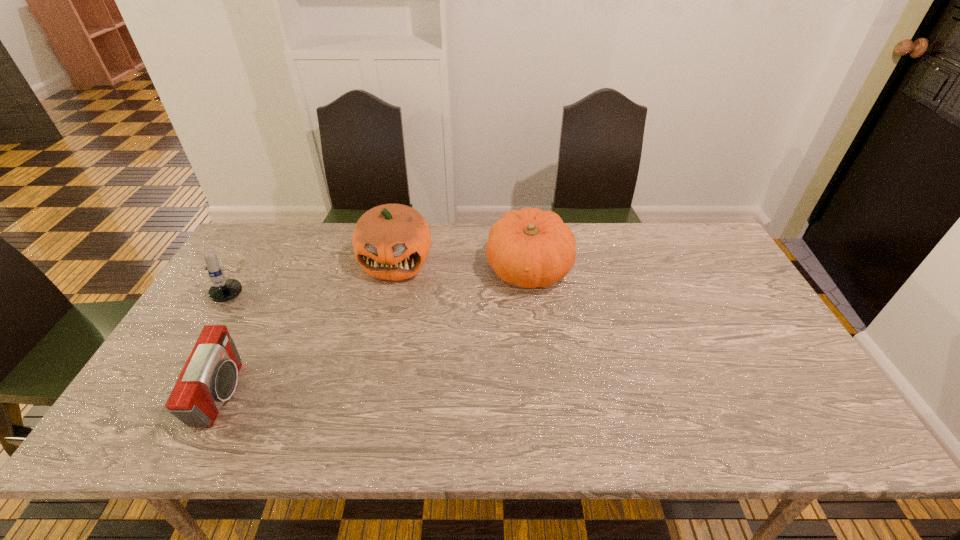
You are a GUI agent. You are given a task and a screenshot of the screen. Output one action in this format:
    pyautogui.click(x=<x>, y=<y>)
    Task: Click on the vacant area that lies between the right pumpkin and the left pumpkin
    
    Given the screenshot: What is the action you would take?
    pyautogui.click(x=462, y=265)

Where is `free spot between the second object from right to left and the rightmost object`? free spot between the second object from right to left and the rightmost object is located at coordinates (462, 265).

The image size is (960, 540). I want to click on vacant area between the third object from left to right and the leftmost object, so click(317, 272).

This screenshot has height=540, width=960. What are the coordinates of `free space between the left pumpkin and the right pumpkin` in the screenshot? It's located at (462, 265).

The image size is (960, 540). In order to click on free area in between the leftmost object and the left pumpkin in this screenshot , I will do `click(317, 272)`.

Where is `vacant space that is in between the second object from right to left and the microphone`? vacant space that is in between the second object from right to left and the microphone is located at coordinates (317, 272).

Identify which object is located as the nearest to the microphone. Please provide its 2D coordinates. Your answer should be formatted as a tuple, i.e. [(x, y)], where the tuple contains the x and y coordinates of a point satisfying the conditions above.

[(209, 378)]

Identify which object is located as the second nearest to the nearest object. Please provide its 2D coordinates. Your answer should be formatted as a tuple, i.e. [(x, y)], where the tuple contains the x and y coordinates of a point satisfying the conditions above.

[(392, 241)]

Locate an element on the screen. The image size is (960, 540). vacant space that satisfies the following two spatial constraints: 1. on the face of the left pumpkin; 2. on the front-facing side of the second object from left to right is located at coordinates (367, 394).

I want to click on free space in the image that satisfies the following two spatial constraints: 1. on the face of the third object from left to right; 2. on the right side of the right pumpkin, so click(394, 269).